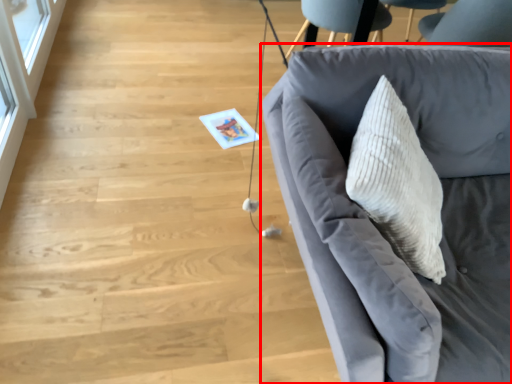
Question: Observing the image, what is the correct spatial positioning of studio couch (annotated by the red box) in reference to glass door?

Choices:
 (A) left
 (B) right

Answer: (B)